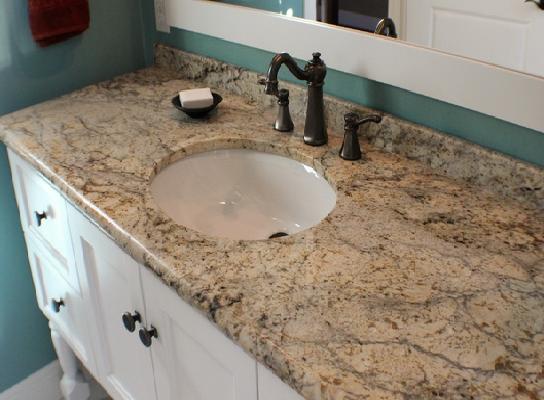
The image size is (544, 400). I want to click on sink fixture, so click(x=317, y=93), click(x=284, y=113), click(x=350, y=143).